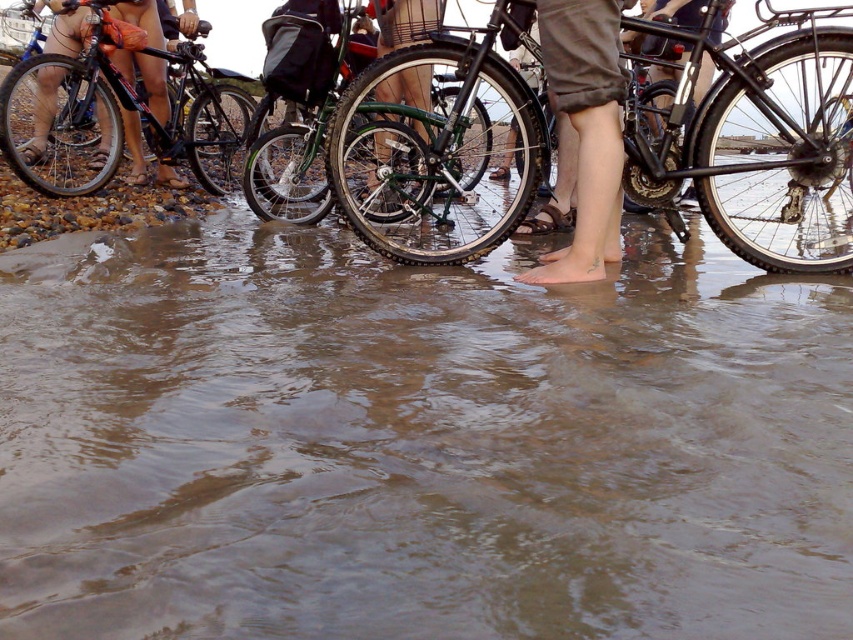
Question: Among these objects, which one is nearest to the camera?

Choices:
 (A) skinny jeans at lower center
 (B) shiny black bicycle at upper left
 (C) brown murky water at center
 (D) green matte bicycle at center

Answer: (C)

Question: Where is skinny jeans at lower center located in relation to green matte bicycle at center in the image?

Choices:
 (A) right
 (B) left

Answer: (A)

Question: Is brown murky water at center to the right of green matte bicycle at center from the viewer's perspective?

Choices:
 (A) no
 (B) yes

Answer: (B)

Question: Which of the following is the closest to the observer?

Choices:
 (A) shiny black bicycle at upper left
 (B) green matte bicycle at center
 (C) brown murky water at center

Answer: (C)

Question: Does shiny black bicycle at upper left come behind skinny jeans at lower center?

Choices:
 (A) yes
 (B) no

Answer: (A)

Question: Which of the following is the farthest from the observer?

Choices:
 (A) green matte bicycle at center
 (B) shiny black bicycle at upper left
 (C) brown murky water at center
 (D) skinny jeans at lower center

Answer: (B)